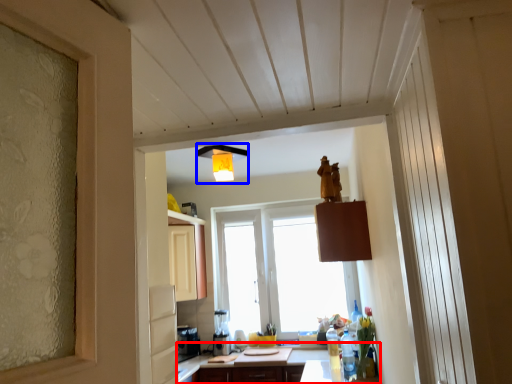
Question: Which point is further to the camera, countertop (highlighted by a red box) or light fixture (highlighted by a blue box)?

Choices:
 (A) countertop
 (B) light fixture

Answer: (A)